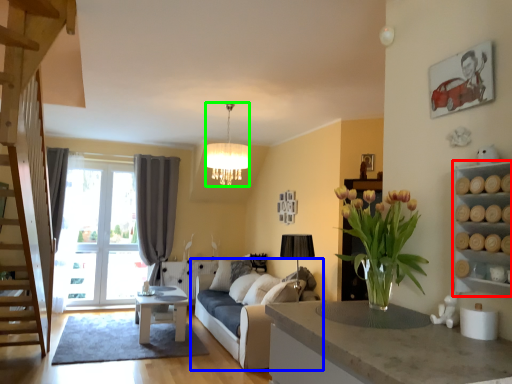
Question: Which object is the closest to the cabinet (highlighted by a red box)? Choose among these: studio couch (highlighted by a blue box) or lamp (highlighted by a green box).

Choices:
 (A) studio couch
 (B) lamp

Answer: (B)